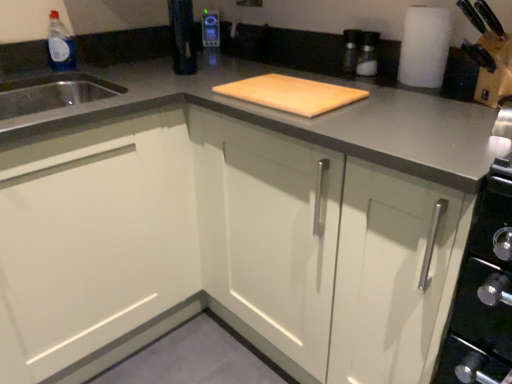
This screenshot has height=384, width=512. What do you see at coordinates (216, 247) in the screenshot? I see `white matte cabinet at center, placed as the second cabinetry when sorted from left to right` at bounding box center [216, 247].

Locate an element on the screen. white matte cabinet at left, the first cabinetry viewed from the left is located at coordinates pyautogui.click(x=93, y=239).

Where is `transparent plastic bottle at upper left`? Image resolution: width=512 pixels, height=384 pixels. transparent plastic bottle at upper left is located at coordinates (60, 45).

Identify the location of white matte cabinet at center, placed as the second cabinetry when sorted from left to right. (216, 247).

How many degrees apart are the facing directions of natural wood cutting board at center and white matte cabinet at center, placed as the second cabinetry when sorted from left to right?

natural wood cutting board at center and white matte cabinet at center, placed as the second cabinetry when sorted from left to right, are facing 0.53 degrees away from each other.

From the image's perspective, between natural wood cutting board at center and white matte cabinet at center, marked as the first cabinetry in a right-to-left arrangement, who is located below?

white matte cabinet at center, marked as the first cabinetry in a right-to-left arrangement.

Which is further, (337, 85) or (157, 217)?

The point (157, 217) is more distant.

Considering the sizes of objects natural wood cutting board at center and white matte cabinet at center, marked as the first cabinetry in a right-to-left arrangement, in the image provided, who is shorter, natural wood cutting board at center or white matte cabinet at center, marked as the first cabinetry in a right-to-left arrangement,?

Standing shorter between the two is natural wood cutting board at center.

From the picture: Is metallic silver toaster at upper center located outside white matte paper towel at upper right?

metallic silver toaster at upper center lies outside white matte paper towel at upper right's area.

From the image's perspective, is metallic silver toaster at upper center above white matte paper towel at upper right?

Indeed, from the image's perspective, metallic silver toaster at upper center is shown above white matte paper towel at upper right.

Can you confirm if metallic silver toaster at upper center is positioned to the left of white matte paper towel at upper right?

Yes.

Can you tell me how much metallic silver toaster at upper center and white matte paper towel at upper right differ in facing direction?

43.4 degrees.

Do you think white matte cabinet at center, marked as the first cabinetry in a right-to-left arrangement, is within metallic silver toaster at upper center, or outside of it?

white matte cabinet at center, marked as the first cabinetry in a right-to-left arrangement, is not inside metallic silver toaster at upper center, it's outside.

Is white matte cabinet at center, placed as the second cabinetry when sorted from left to right, oriented towards metallic silver toaster at upper center?

No, white matte cabinet at center, placed as the second cabinetry when sorted from left to right, is not facing towards metallic silver toaster at upper center.

Which is farther, (126, 192) or (202, 33)?

The point (202, 33) is more distant.

Is there a large distance between white matte paper towel at upper right and white matte cabinet at center, placed as the second cabinetry when sorted from left to right?

No, there isn't a large distance between white matte paper towel at upper right and white matte cabinet at center, placed as the second cabinetry when sorted from left to right.

Who is more distant, white matte paper towel at upper right or white matte cabinet at center, placed as the second cabinetry when sorted from left to right?

white matte paper towel at upper right is further away from the camera.

Is white matte cabinet at center, marked as the first cabinetry in a right-to-left arrangement, at the back of white matte paper towel at upper right?

white matte paper towel at upper right is not turned away from white matte cabinet at center, marked as the first cabinetry in a right-to-left arrangement.

Relative to metallic silver toaster at upper center, is white matte cabinet at left, the first cabinetry viewed from the left, in front or behind?

white matte cabinet at left, the first cabinetry viewed from the left, is positioned closer to the viewer than metallic silver toaster at upper center.

Which object is positioned more to the right, white matte cabinet at left, placed as the second cabinetry when sorted from right to left, or metallic silver toaster at upper center?

From the viewer's perspective, metallic silver toaster at upper center appears more on the right side.

From the image's perspective, is white matte cabinet at left, the first cabinetry viewed from the left, above metallic silver toaster at upper center?

No, from the image's perspective, white matte cabinet at left, the first cabinetry viewed from the left, is not above metallic silver toaster at upper center.

Which point is more distant from viewer, (x=139, y=284) or (x=213, y=29)?

Positioned behind is point (x=213, y=29).

Does point (357, 100) appear closer or farther from the camera than point (62, 24)?

Point (357, 100).

Is transparent plastic bottle at upper left located within natural wood cutting board at center?

No.

From the image's perspective, which is above, natural wood cutting board at center or transparent plastic bottle at upper left?

transparent plastic bottle at upper left appears higher in the image.

Can you tell me how much natural wood cutting board at center and transparent plastic bottle at upper left differ in facing direction?

The facing directions of natural wood cutting board at center and transparent plastic bottle at upper left are 90 degrees apart.

Does natural wood cutting board at center appear on the right side of white matte cabinet at left, the first cabinetry viewed from the left?

Indeed, natural wood cutting board at center is positioned on the right side of white matte cabinet at left, the first cabinetry viewed from the left.

Starting from the natural wood cutting board at center, which cabinetry is the 1st one in front? Please provide its 2D coordinates.

[(93, 239)]

Considering the sizes of natural wood cutting board at center and white matte cabinet at left, placed as the second cabinetry when sorted from right to left, in the image, is natural wood cutting board at center taller or shorter than white matte cabinet at left, placed as the second cabinetry when sorted from right to left,?

Considering their sizes, natural wood cutting board at center has less height than white matte cabinet at left, placed as the second cabinetry when sorted from right to left.

Is natural wood cutting board at center completely or partially outside of white matte cabinet at left, placed as the second cabinetry when sorted from right to left?

Yes, natural wood cutting board at center is outside of white matte cabinet at left, placed as the second cabinetry when sorted from right to left.

Where is `cabinetry on the right of natural wood cutting board at center`? This screenshot has height=384, width=512. cabinetry on the right of natural wood cutting board at center is located at coordinates (216, 247).

The width and height of the screenshot is (512, 384). In order to click on appliance on the left of the white matte paper towel at upper right in this screenshot , I will do `click(211, 28)`.

Consider the image. Based on their spatial positions, is natural wood cutting board at center or white matte paper towel at upper right closer to white matte cabinet at left, the first cabinetry viewed from the left?

Based on the image, natural wood cutting board at center appears to be nearer to white matte cabinet at left, the first cabinetry viewed from the left.

Looking at the image, which one is located closer to white matte cabinet at left, the first cabinetry viewed from the left, white matte paper towel at upper right or transparent plastic bottle at upper left?

transparent plastic bottle at upper left is positioned closer to the anchor white matte cabinet at left, the first cabinetry viewed from the left.

From the picture: Based on their spatial positions, is white matte paper towel at upper right or natural wood cutting board at center closer to white matte cabinet at center, placed as the second cabinetry when sorted from left to right?

The object closer to white matte cabinet at center, placed as the second cabinetry when sorted from left to right, is natural wood cutting board at center.

Estimate the real-world distances between objects in this image. Which object is closer to natural wood cutting board at center, transparent plastic bottle at upper left or white matte cabinet at left, placed as the second cabinetry when sorted from right to left?

white matte cabinet at left, placed as the second cabinetry when sorted from right to left.

Considering their positions, is transparent plastic bottle at upper left positioned further to white matte cabinet at center, marked as the first cabinetry in a right-to-left arrangement, than white matte cabinet at left, placed as the second cabinetry when sorted from right to left?

transparent plastic bottle at upper left is further to white matte cabinet at center, marked as the first cabinetry in a right-to-left arrangement.

Considering their positions, is transparent plastic bottle at upper left positioned further to natural wood cutting board at center than white matte paper towel at upper right?

transparent plastic bottle at upper left is positioned further to the anchor natural wood cutting board at center.

Looking at the image, which one is located closer to metallic silver toaster at upper center, white matte cabinet at center, placed as the second cabinetry when sorted from left to right, or natural wood cutting board at center?

The object closer to metallic silver toaster at upper center is natural wood cutting board at center.

From the image, which object appears to be nearer to white matte cabinet at left, the first cabinetry viewed from the left, natural wood cutting board at center or metallic silver toaster at upper center?

natural wood cutting board at center lies closer to white matte cabinet at left, the first cabinetry viewed from the left, than the other object.

In order to click on paper towel between natural wood cutting board at center and metallic silver toaster at upper center along the z-axis in this screenshot , I will do `click(424, 46)`.

I want to click on cutting board located between white matte cabinet at center, marked as the first cabinetry in a right-to-left arrangement, and metallic silver toaster at upper center in the depth direction, so click(x=292, y=94).

At what (x,y) coordinates should I click in order to perform the action: click on cabinetry between transparent plastic bottle at upper left and white matte cabinet at center, marked as the first cabinetry in a right-to-left arrangement, in the horizontal direction. Please return your answer as a coordinate pair (x, y). The image size is (512, 384). Looking at the image, I should click on (93, 239).

The width and height of the screenshot is (512, 384). Identify the location of appliance between transparent plastic bottle at upper left and white matte paper towel at upper right in the horizontal direction. (211, 28).